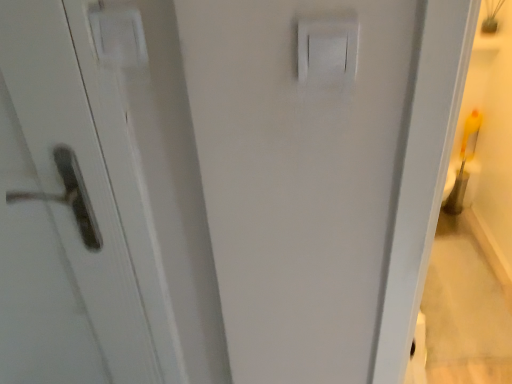
Question: In the image, is white plastic light switch at upper center positioned in front of or behind matte white handle at left?

Choices:
 (A) front
 (B) behind

Answer: (A)

Question: Considering the positions of point (310, 49) and point (23, 155), is point (310, 49) closer or farther from the camera than point (23, 155)?

Choices:
 (A) farther
 (B) closer

Answer: (B)

Question: Based on their sizes in the image, would you say white plastic light switch at upper center is bigger or smaller than matte white handle at left?

Choices:
 (A) big
 (B) small

Answer: (B)

Question: In the image, is matte white handle at left on the left side or the right side of white plastic light switch at upper center?

Choices:
 (A) left
 (B) right

Answer: (A)

Question: Considering the positions of point (0, 221) and point (330, 51), is point (0, 221) closer or farther from the camera than point (330, 51)?

Choices:
 (A) closer
 (B) farther

Answer: (B)

Question: Relative to white plastic light switch at upper center, is matte white handle at left in front or behind?

Choices:
 (A) front
 (B) behind

Answer: (B)

Question: In terms of width, does matte white handle at left look wider or thinner when compared to white plastic light switch at upper center?

Choices:
 (A) thin
 (B) wide

Answer: (B)